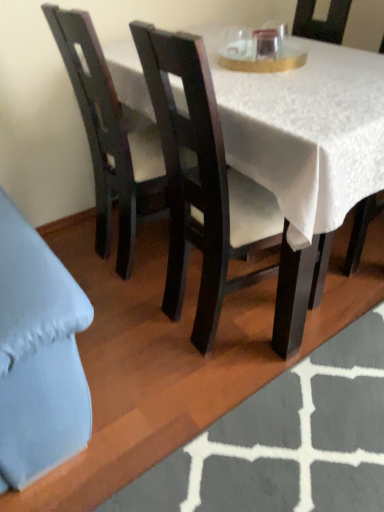
Question: Is matte dark wood chair at center, which is the 2th chair in right-to-left order, next to matte black chair at center, which is counted as the first chair, starting from the right?

Choices:
 (A) no
 (B) yes

Answer: (A)

Question: From a real-world perspective, is matte dark wood chair at center, which is the 2th chair in right-to-left order, below matte black chair at center, which is counted as the first chair, starting from the right?

Choices:
 (A) no
 (B) yes

Answer: (A)

Question: Could matte black chair at center, which is counted as the first chair, starting from the right, be considered to be inside matte dark wood chair at center, which is the 2th chair in right-to-left order?

Choices:
 (A) no
 (B) yes

Answer: (A)

Question: From a real-world perspective, is matte dark wood chair at center, which is the 2th chair in right-to-left order, positioned over matte black chair at center, which is the third chair from left to right, based on gravity?

Choices:
 (A) no
 (B) yes

Answer: (B)

Question: From the image's perspective, is matte dark wood chair at center, which is the 2th chair in right-to-left order, below matte black chair at center, which is the third chair from left to right?

Choices:
 (A) no
 (B) yes

Answer: (B)

Question: Does matte dark wood chair at center, which is the 2th chair in left-to-right order, have a larger size compared to matte black chair at center, which is counted as the first chair, starting from the right?

Choices:
 (A) no
 (B) yes

Answer: (B)

Question: From the image's perspective, is matte dark wood chair at center, which is the 2th chair in left-to-right order, located beneath dark wood chair at left, which is the third chair in right-to-left order?

Choices:
 (A) no
 (B) yes

Answer: (B)

Question: Is matte dark wood chair at center, which is the 2th chair in right-to-left order, positioned behind dark wood chair at left, which is the third chair in right-to-left order?

Choices:
 (A) no
 (B) yes

Answer: (A)

Question: Considering the relative sizes of matte dark wood chair at center, which is the 2th chair in right-to-left order, and dark wood chair at left, the first chair viewed from the left, in the image provided, is matte dark wood chair at center, which is the 2th chair in right-to-left order, bigger than dark wood chair at left, the first chair viewed from the left,?

Choices:
 (A) no
 (B) yes

Answer: (B)

Question: Are matte dark wood chair at center, which is the 2th chair in right-to-left order, and dark wood chair at left, the first chair viewed from the left, far apart?

Choices:
 (A) no
 (B) yes

Answer: (A)

Question: Is matte dark wood chair at center, which is the 2th chair in right-to-left order, oriented away from dark wood chair at left, the first chair viewed from the left?

Choices:
 (A) yes
 (B) no

Answer: (B)

Question: Is matte dark wood chair at center, which is the 2th chair in right-to-left order, to the right of dark wood chair at left, which is the third chair in right-to-left order, from the viewer's perspective?

Choices:
 (A) no
 (B) yes

Answer: (B)

Question: From the image's perspective, is matte black chair at center, which is the third chair from left to right, over white textured rug at lower center?

Choices:
 (A) no
 (B) yes

Answer: (B)